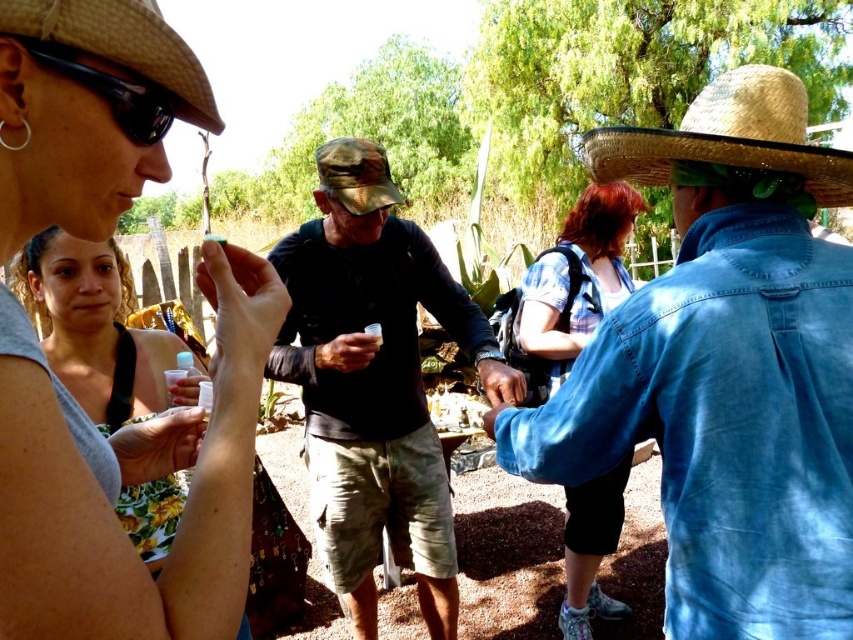
Question: Which object is the closest to the denim jacket at upper right?

Choices:
 (A) straw hat at upper left
 (B) straw hat at upper right
 (C) matte gray tank top at upper left

Answer: (B)

Question: Does matte gray tank top at upper left have a larger size compared to matte black goggles at upper left?

Choices:
 (A) no
 (B) yes

Answer: (B)

Question: Does matte gray tank top at upper left come in front of camouflage fabric hat at center?

Choices:
 (A) no
 (B) yes

Answer: (B)

Question: Among these points, which one is farthest from the camera?

Choices:
 (A) (804, 157)
 (B) (347, 442)
 (C) (57, 240)
 (D) (332, 148)

Answer: (B)

Question: Which of the following is the farthest from the observer?

Choices:
 (A) matte gray tank top at upper left
 (B) plaid shirt at center

Answer: (B)

Question: Can you confirm if straw hat at upper right is positioned to the right of camouflage fabric bucket hat at center?

Choices:
 (A) no
 (B) yes

Answer: (B)